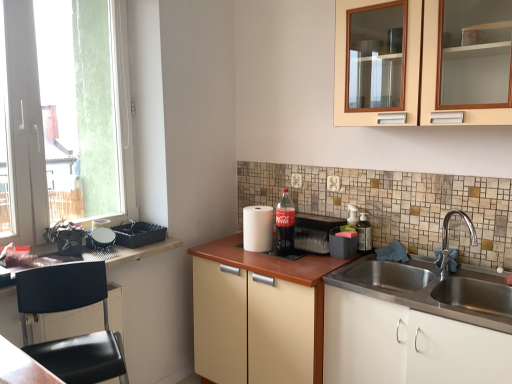
Question: Can you confirm if wooden countertop at left is thinner than beige wood cabinet at upper center, the first cabinetry viewed from the top?

Choices:
 (A) yes
 (B) no

Answer: (B)

Question: From the image's perspective, is wooden countertop at left on beige wood cabinet at upper center, the first cabinetry viewed from the top?

Choices:
 (A) no
 (B) yes

Answer: (A)

Question: Would you say wooden countertop at left is outside beige wood cabinet at upper center, acting as the fourth cabinetry starting from the bottom?

Choices:
 (A) yes
 (B) no

Answer: (A)

Question: Does wooden countertop at left appear on the left side of beige wood cabinet at upper center, acting as the fourth cabinetry starting from the bottom?

Choices:
 (A) yes
 (B) no

Answer: (A)

Question: From a real-world perspective, is wooden countertop at left located beneath beige wood cabinet at upper center, the first cabinetry viewed from the top?

Choices:
 (A) yes
 (B) no

Answer: (A)

Question: In terms of size, does wooden countertop at left appear bigger or smaller than translucent plastic soap dispenser at right, marked as the second bottle in a left-to-right arrangement?

Choices:
 (A) small
 (B) big

Answer: (B)

Question: Is wooden countertop at left wider or thinner than translucent plastic soap dispenser at right, the 1th bottle in the right-to-left sequence?

Choices:
 (A) wide
 (B) thin

Answer: (A)

Question: From a real-world perspective, is wooden countertop at left above or below translucent plastic soap dispenser at right, marked as the second bottle in a left-to-right arrangement?

Choices:
 (A) below
 (B) above

Answer: (A)

Question: Is wooden countertop at left taller or shorter than translucent plastic soap dispenser at right, marked as the second bottle in a left-to-right arrangement?

Choices:
 (A) tall
 (B) short

Answer: (B)

Question: Considering the positions of black plastic chair at lower left, the third cabinetry in the bottom-to-top sequence, and black plastic tray at left, arranged as the first appliance when viewed from the left, in the image, is black plastic chair at lower left, the third cabinetry in the bottom-to-top sequence, wider or thinner than black plastic tray at left, arranged as the first appliance when viewed from the left,?

Choices:
 (A) thin
 (B) wide

Answer: (B)

Question: From a real-world perspective, is black plastic chair at lower left, the third cabinetry in the bottom-to-top sequence, positioned above or below black plastic tray at left, positioned as the 4th appliance in right-to-left order?

Choices:
 (A) below
 (B) above

Answer: (A)

Question: Is point pyautogui.click(x=110, y=279) closer or farther from the camera than point pyautogui.click(x=162, y=238)?

Choices:
 (A) farther
 (B) closer

Answer: (B)

Question: Is black plastic chair at lower left, which is the 2th cabinetry from top to bottom, inside or outside of black plastic tray at left, arranged as the first appliance when viewed from the left?

Choices:
 (A) outside
 (B) inside

Answer: (A)

Question: Considering the positions of black plastic chair at lower left, the third cabinetry in the bottom-to-top sequence, and matte plastic soda at center, acting as the third appliance starting from the left, in the image, is black plastic chair at lower left, the third cabinetry in the bottom-to-top sequence, bigger or smaller than matte plastic soda at center, acting as the third appliance starting from the left,?

Choices:
 (A) small
 (B) big

Answer: (B)

Question: In terms of height, does black plastic chair at lower left, the third cabinetry in the bottom-to-top sequence, look taller or shorter compared to matte plastic soda at center, which is the 2th appliance in right-to-left order?

Choices:
 (A) tall
 (B) short

Answer: (A)